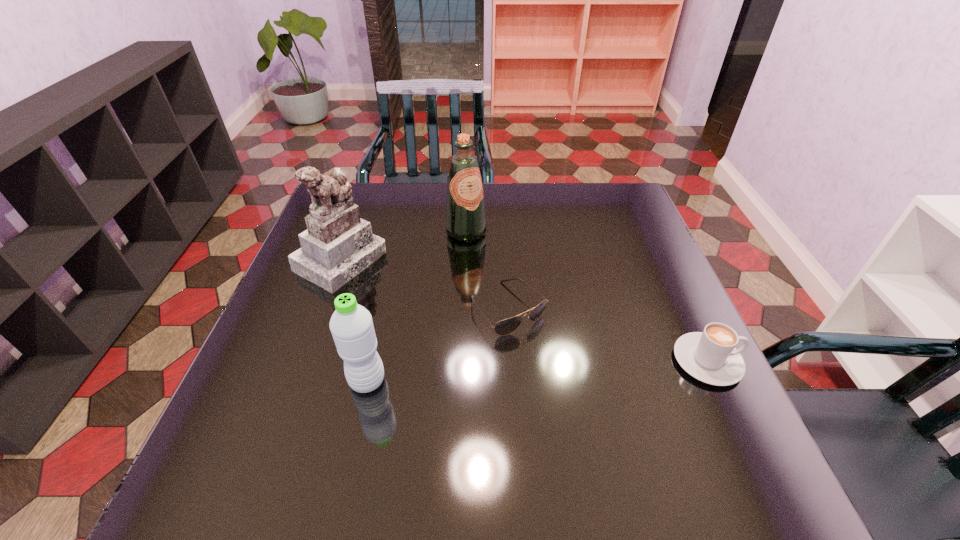
Identify the location of free space located 0.210m on the front-facing side of the shortest object. (595, 403).

At what (x,y) coordinates should I click in order to perform the action: click on vacant space located on the front-facing side of the shortest object. Please return your answer as a coordinate pair (x, y). Looking at the image, I should click on (x=613, y=423).

At what (x,y) coordinates should I click in order to perform the action: click on free region located 0.250m on the front-facing side of the shortest object. Please return your answer as a coordinate pair (x, y). The image size is (960, 540). Looking at the image, I should click on (610, 419).

Where is `free space located 0.110m on the front-facing side of the figurine`? The height and width of the screenshot is (540, 960). free space located 0.110m on the front-facing side of the figurine is located at coordinates (404, 295).

At what (x,y) coordinates should I click in order to perform the action: click on free space located 0.220m on the front-facing side of the figurine. Please return your answer as a coordinate pair (x, y). The width and height of the screenshot is (960, 540). Looking at the image, I should click on (439, 314).

The image size is (960, 540). What are the coordinates of `free space located 0.380m on the front-facing side of the figurine` in the screenshot? It's located at (494, 345).

Locate an element on the screen. The width and height of the screenshot is (960, 540). object that is at the far edge is located at coordinates (465, 212).

Locate an element on the screen. This screenshot has width=960, height=540. object situated at the left edge is located at coordinates (337, 245).

What are the coordinates of `object located in the right edge section of the desktop` in the screenshot? It's located at (710, 356).

This screenshot has width=960, height=540. In the image, there is a desktop. Find the location of `free region at the far edge`. free region at the far edge is located at coordinates (410, 210).